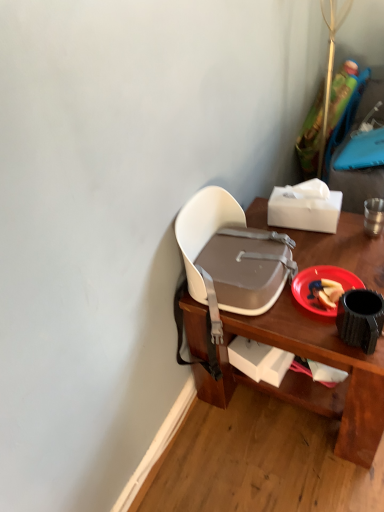
How much space does white matte box at lower center, which ranks as the second box in top-to-bottom order, occupy vertically?

white matte box at lower center, which ranks as the second box in top-to-bottom order, is 7.43 inches in height.

Identify the location of white plastic chair at center. The image size is (384, 512). (227, 259).

This screenshot has height=512, width=384. Find the location of `white matte tissue box at upper right, which is the 1th box from top to bottom`. white matte tissue box at upper right, which is the 1th box from top to bottom is located at coordinates (305, 207).

Is red plastic plate at lower right not inside white plastic chair at upper center?

No, most part of red plastic plate at lower right lies within white plastic chair at upper center.

Are red plastic plate at lower right and white plastic chair at upper center beside each other?

red plastic plate at lower right is not next to white plastic chair at upper center, and they're not touching.

Is red plastic plate at lower right positioned before white plastic chair at upper center?

No, red plastic plate at lower right is further to the viewer.

The width and height of the screenshot is (384, 512). What are the coordinates of `desk in front of the red plastic plate at lower right` in the screenshot? It's located at (305, 376).

Which is more to the left, white plastic chair at center or white matte box at lower center, which ranks as the second box in top-to-bottom order?

white plastic chair at center is more to the left.

Is white plastic chair at center directly adjacent to white matte box at lower center, which ranks as the 1th box in bottom-to-top order?

There is a gap between white plastic chair at center and white matte box at lower center, which ranks as the 1th box in bottom-to-top order.

Is white plastic chair at center wider or thinner than white matte box at lower center, which ranks as the second box in top-to-bottom order?

In the image, white plastic chair at center appears to be wider than white matte box at lower center, which ranks as the second box in top-to-bottom order.

Would you say red plastic plate at lower right is a long distance from white matte tissue box at upper right, which is the 1th box from top to bottom?

red plastic plate at lower right is near white matte tissue box at upper right, which is the 1th box from top to bottom, not far away.

Identify the location of box that appears on the right of red plastic plate at lower right. The width and height of the screenshot is (384, 512). (305, 207).

Could you tell me if red plastic plate at lower right is turned towards white matte tissue box at upper right, the second box in the bottom-to-top sequence?

No.

Can you tell me how much red plastic plate at lower right and white matte tissue box at upper right, the second box in the bottom-to-top sequence, differ in facing direction?

The angle between the facing direction of red plastic plate at lower right and the facing direction of white matte tissue box at upper right, the second box in the bottom-to-top sequence, is 8.05 degrees.

Is white matte tissue box at upper right, the second box in the bottom-to-top sequence, inside or outside of white matte box at lower center, which ranks as the second box in top-to-bottom order?

white matte tissue box at upper right, the second box in the bottom-to-top sequence, exists outside the volume of white matte box at lower center, which ranks as the second box in top-to-bottom order.

Based on the photo, from the image's perspective, does white matte tissue box at upper right, which is the 1th box from top to bottom, appear lower than white matte box at lower center, which ranks as the second box in top-to-bottom order?

Incorrect, from the image's perspective, white matte tissue box at upper right, which is the 1th box from top to bottom, is higher than white matte box at lower center, which ranks as the second box in top-to-bottom order.

Is white matte tissue box at upper right, which is the 1th box from top to bottom, oriented away from white matte box at lower center, which ranks as the 1th box in bottom-to-top order?

That's not correct — white matte tissue box at upper right, which is the 1th box from top to bottom, is not looking away from white matte box at lower center, which ranks as the 1th box in bottom-to-top order.

From the picture: Between white matte tissue box at upper right, the second box in the bottom-to-top sequence, and white matte box at lower center, which ranks as the 1th box in bottom-to-top order, which one appears on the right side from the viewer's perspective?

white matte tissue box at upper right, the second box in the bottom-to-top sequence, is more to the right.

Considering the relative sizes of white plastic chair at center and white matte tissue box at upper right, which is the 1th box from top to bottom, in the image provided, is white plastic chair at center shorter than white matte tissue box at upper right, which is the 1th box from top to bottom,?

No, white plastic chair at center is not shorter than white matte tissue box at upper right, which is the 1th box from top to bottom.

From the picture: From a real-world perspective, between white plastic chair at center and white matte tissue box at upper right, which is the 1th box from top to bottom, who is vertically higher?

From a 3D spatial view, white matte tissue box at upper right, which is the 1th box from top to bottom, is above.

Which of these two, white plastic chair at center or white matte tissue box at upper right, the second box in the bottom-to-top sequence, is wider?

white plastic chair at center is wider.

From a real-world perspective, between white plastic chair at center and red plastic plate at lower right, who is vertically lower?

In real-world perspective, white plastic chair at center is lower.

Is white plastic chair at center looking in the opposite direction of red plastic plate at lower right?

Correct, white plastic chair at center is looking away from red plastic plate at lower right.

From their relative heights in the image, would you say white plastic chair at center is taller or shorter than red plastic plate at lower right?

Clearly, white plastic chair at center is taller compared to red plastic plate at lower right.

Consider the image. Can you tell me how much white plastic chair at center and red plastic plate at lower right differ in facing direction?

0.9 degrees separate the facing orientations of white plastic chair at center and red plastic plate at lower right.

Is white matte tissue box at upper right, which is the 1th box from top to bottom, not close to red plastic plate at lower right?

white matte tissue box at upper right, which is the 1th box from top to bottom, is actually quite close to red plastic plate at lower right.

Does point (313, 191) lie behind point (347, 279)?

Yes.

Which of these two, white matte tissue box at upper right, which is the 1th box from top to bottom, or red plastic plate at lower right, stands taller?

white matte tissue box at upper right, which is the 1th box from top to bottom, is taller.

How many degrees apart are the facing directions of white matte tissue box at upper right, which is the 1th box from top to bottom, and red plastic plate at lower right?

8.05 degrees separate the facing orientations of white matte tissue box at upper right, which is the 1th box from top to bottom, and red plastic plate at lower right.

Locate an element on the screen. The image size is (384, 512). desk in front of the red plastic plate at lower right is located at coordinates (305, 376).

Locate an element on the screen. box below the white plastic chair at center (from the image's perspective) is located at coordinates (259, 360).

Looking at this image, estimate the real-world distances between objects in this image. Which object is further from white plastic chair at upper center, red plastic plate at lower right or white matte tissue box at upper right, the second box in the bottom-to-top sequence?

Based on the image, white matte tissue box at upper right, the second box in the bottom-to-top sequence, appears to be further to white plastic chair at upper center.

From the image, which object appears to be nearer to white matte tissue box at upper right, the second box in the bottom-to-top sequence, white plastic chair at center or white plastic chair at upper center?

white plastic chair at center lies closer to white matte tissue box at upper right, the second box in the bottom-to-top sequence, than the other object.

Based on their spatial positions, is white plastic chair at center or white matte box at lower center, which ranks as the 1th box in bottom-to-top order, closer to white matte tissue box at upper right, which is the 1th box from top to bottom?

white plastic chair at center is closer to white matte tissue box at upper right, which is the 1th box from top to bottom.

Consider the image. Based on their spatial positions, is white plastic chair at center or white matte tissue box at upper right, which is the 1th box from top to bottom, closer to white matte box at lower center, which ranks as the second box in top-to-bottom order?

white plastic chair at center.

Looking at the image, which one is located closer to white plastic chair at center, white plastic chair at upper center or white matte box at lower center, which ranks as the second box in top-to-bottom order?

Based on the image, white plastic chair at upper center appears to be nearer to white plastic chair at center.

Estimate the real-world distances between objects in this image. Which object is closer to white plastic chair at center, white matte tissue box at upper right, which is the 1th box from top to bottom, or white plastic chair at upper center?

Based on the image, white plastic chair at upper center appears to be nearer to white plastic chair at center.

Estimate the real-world distances between objects in this image. Which object is closer to white plastic chair at upper center, white matte box at lower center, which ranks as the second box in top-to-bottom order, or red plastic plate at lower right?

The object closer to white plastic chair at upper center is white matte box at lower center, which ranks as the second box in top-to-bottom order.

Looking at the image, which one is located closer to white plastic chair at center, red plastic plate at lower right or white matte box at lower center, which ranks as the 1th box in bottom-to-top order?

Based on the image, red plastic plate at lower right appears to be nearer to white plastic chair at center.

Locate an element on the screen. Image resolution: width=384 pixels, height=512 pixels. plate between white plastic chair at center and white plastic chair at upper center in the horizontal direction is located at coordinates 319,280.

At what (x,y) coordinates should I click in order to perform the action: click on plate between white matte tissue box at upper right, which is the 1th box from top to bottom, and white plastic chair at upper center vertically. Please return your answer as a coordinate pair (x, y). This screenshot has width=384, height=512. Looking at the image, I should click on (319, 280).

This screenshot has height=512, width=384. In order to click on plate positioned between white plastic chair at upper center and white matte box at lower center, which ranks as the 1th box in bottom-to-top order, from near to far in this screenshot , I will do [x=319, y=280].

I want to click on plate between white matte tissue box at upper right, which is the 1th box from top to bottom, and white matte box at lower center, which ranks as the second box in top-to-bottom order, from top to bottom, so pos(319,280).